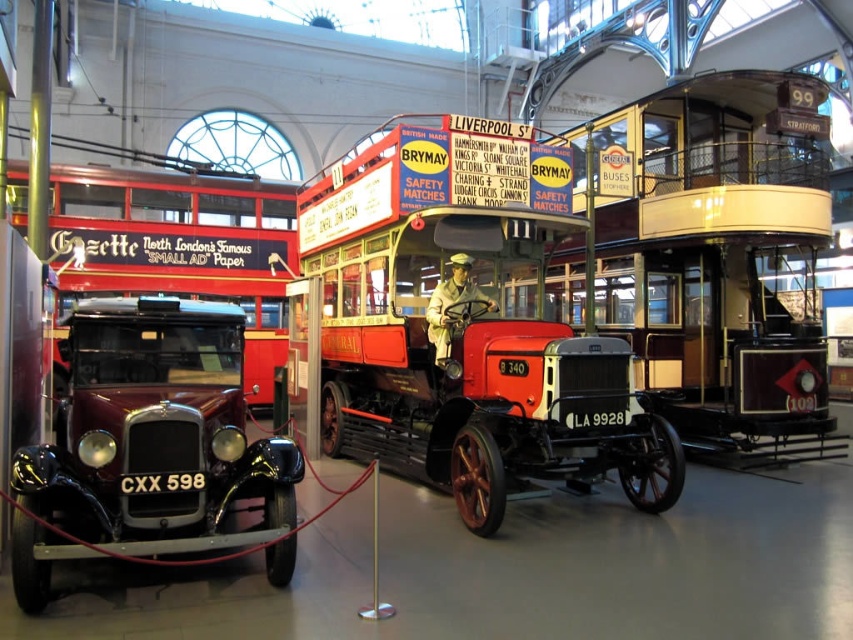
Question: Which point is closer to the camera?

Choices:
 (A) (258, 403)
 (B) (758, 316)
 (C) (453, 300)
 (D) (196, 308)

Answer: (D)

Question: Does red polished wood bus at center have a greater width compared to matte black bus at center?

Choices:
 (A) yes
 (B) no

Answer: (A)

Question: Which point is closer to the camera taking this photo?

Choices:
 (A) (791, 452)
 (B) (399, 252)
 (C) (154, 337)
 (D) (465, 268)

Answer: (C)

Question: Does red polished wood bus at center come in front of red polished wood double-decker bus at left?

Choices:
 (A) no
 (B) yes

Answer: (B)

Question: Which point is farther to the camera?

Choices:
 (A) (430, 320)
 (B) (805, 96)
 (C) (402, 317)
 (D) (45, 596)

Answer: (B)

Question: In this image, where is red polished wood double-decker bus at left located relative to matte red coach at center?

Choices:
 (A) right
 (B) left

Answer: (B)